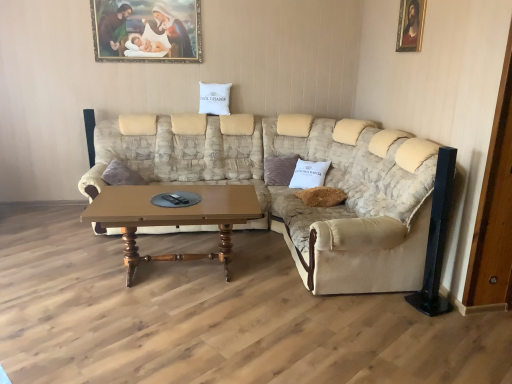
Question: Does beige fabric couch at right lie behind wooden framed portrait at upper right, which ranks as the 2th picture frame in left-to-right order?

Choices:
 (A) no
 (B) yes

Answer: (A)

Question: Is there a large distance between beige fabric couch at right and wooden framed portrait at upper right, positioned as the 2th picture frame in back-to-front order?

Choices:
 (A) yes
 (B) no

Answer: (A)

Question: Considering the relative positions of beige fabric couch at right and wooden framed portrait at upper right, which ranks as the 2th picture frame in left-to-right order, in the image provided, is beige fabric couch at right to the right of wooden framed portrait at upper right, which ranks as the 2th picture frame in left-to-right order, from the viewer's perspective?

Choices:
 (A) yes
 (B) no

Answer: (B)

Question: Is the position of beige fabric couch at right less distant than that of wooden framed portrait at upper right, positioned as the 2th picture frame in back-to-front order?

Choices:
 (A) yes
 (B) no

Answer: (A)

Question: From a real-world perspective, is beige fabric couch at right on top of wooden framed portrait at upper right, acting as the first picture frame starting from the front?

Choices:
 (A) yes
 (B) no

Answer: (B)

Question: From a real-world perspective, relative to beige fabric couch at right, is wooden polished coffee table at center vertically above or below?

Choices:
 (A) above
 (B) below

Answer: (B)

Question: Is wooden polished coffee table at center wider or thinner than beige fabric couch at right?

Choices:
 (A) thin
 (B) wide

Answer: (A)

Question: Does point (220, 208) appear closer or farther from the camera than point (346, 218)?

Choices:
 (A) farther
 (B) closer

Answer: (B)

Question: Looking at the image, does wooden polished coffee table at center seem bigger or smaller compared to beige fabric couch at right?

Choices:
 (A) big
 (B) small

Answer: (B)

Question: Considering the positions of point (266, 170) and point (224, 102), is point (266, 170) closer or farther from the camera than point (224, 102)?

Choices:
 (A) farther
 (B) closer

Answer: (B)

Question: From a real-world perspective, is velvet brown pillow at center, which is counted as the 1th pillow, starting from the bottom, above or below white fabric pillow at upper center, the second pillow from the bottom?

Choices:
 (A) below
 (B) above

Answer: (A)

Question: From the image's perspective, relative to white fabric pillow at upper center, the first pillow positioned from the left, is velvet brown pillow at center, which is counted as the 1th pillow, starting from the bottom, above or below?

Choices:
 (A) above
 (B) below

Answer: (B)

Question: Is velvet brown pillow at center, positioned as the second pillow in top-to-bottom order, bigger or smaller than white fabric pillow at upper center, positioned as the 2th pillow in right-to-left order?

Choices:
 (A) small
 (B) big

Answer: (B)

Question: From a real-world perspective, is velvet brown pillow at center, positioned as the second pillow in top-to-bottom order, physically located above or below beige fabric couch at center?

Choices:
 (A) above
 (B) below

Answer: (B)

Question: Considering the positions of point (265, 158) and point (187, 114), is point (265, 158) closer or farther from the camera than point (187, 114)?

Choices:
 (A) closer
 (B) farther

Answer: (A)